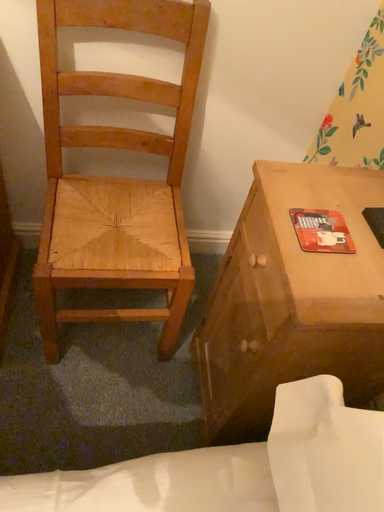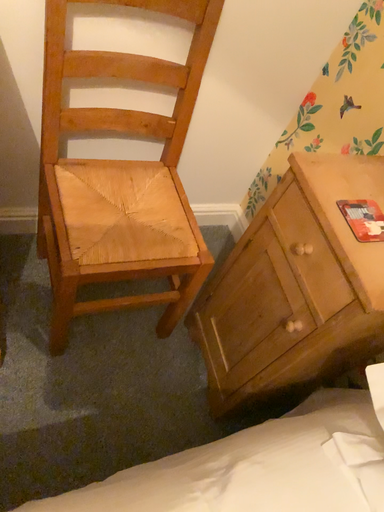
Question: Which way did the camera rotate in the video?

Choices:
 (A) rotated right
 (B) rotated left

Answer: (A)